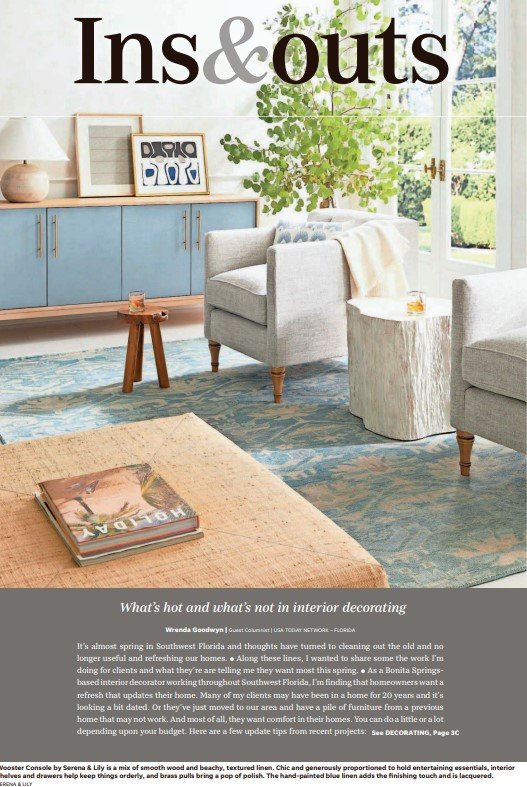
I want to click on knobs, so click(x=439, y=170), click(x=431, y=165).